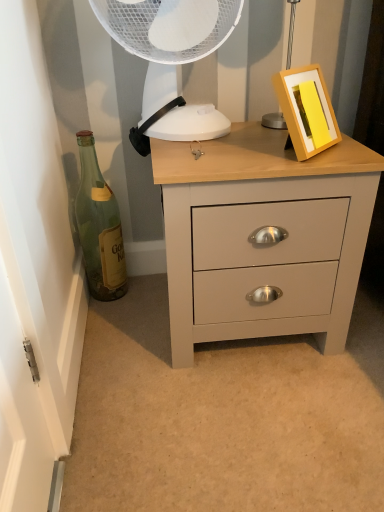
Question: Is point [175, 16] positioned closer to the camera than point [301, 237]?

Choices:
 (A) closer
 (B) farther

Answer: (B)

Question: Considering the positions of white plastic mechanical fan at upper center and matte gray chest of drawers at center in the image, is white plastic mechanical fan at upper center wider or thinner than matte gray chest of drawers at center?

Choices:
 (A) thin
 (B) wide

Answer: (A)

Question: Estimate the real-world distances between objects in this image. Which object is farther from the green glass bottle at left?

Choices:
 (A) white plastic mechanical fan at upper center
 (B) matte gray chest of drawers at center

Answer: (B)

Question: Estimate the real-world distances between objects in this image. Which object is closer to the white plastic mechanical fan at upper center?

Choices:
 (A) green glass bottle at left
 (B) matte gray chest of drawers at center

Answer: (B)